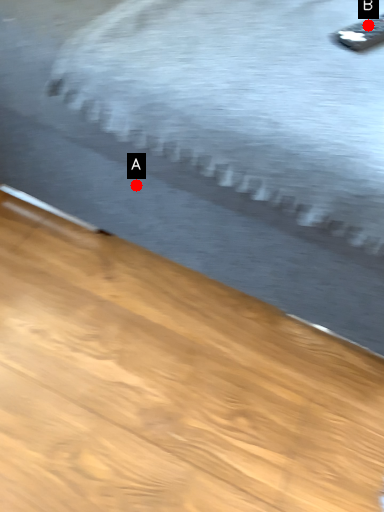
Question: Two points are circled on the image, labeled by A and B beside each circle. Among these points, which one is farthest from the camera?

Choices:
 (A) A is further
 (B) B is further

Answer: (A)